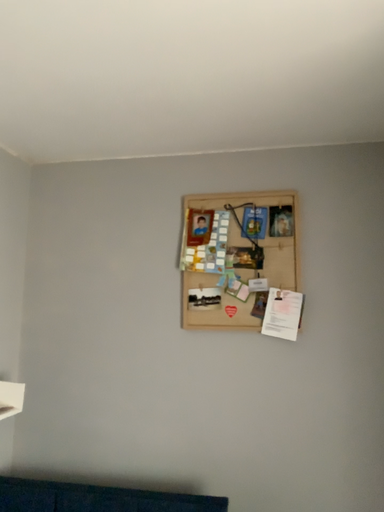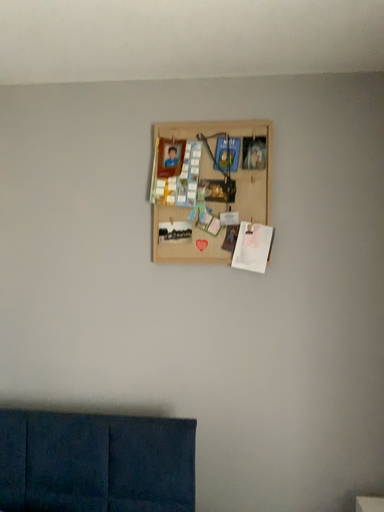
Question: Which way did the camera rotate in the video?

Choices:
 (A) rotated upward
 (B) rotated downward

Answer: (B)